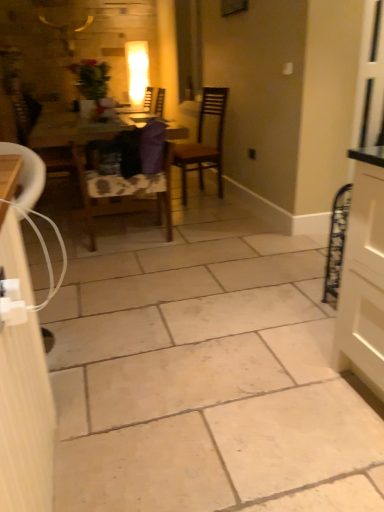
Question: From a real-world perspective, does wooden chair at left, the third chair in the right-to-left sequence, sit lower than brown wooden chair at center, which is counted as the 1th chair, starting from the right?

Choices:
 (A) no
 (B) yes

Answer: (B)

Question: Does wooden chair at left, the third chair in the right-to-left sequence, appear on the left side of brown wooden chair at center, which is counted as the 1th chair, starting from the right?

Choices:
 (A) no
 (B) yes

Answer: (B)

Question: Can you confirm if wooden chair at left, marked as the 1th chair in a left-to-right arrangement, is wider than brown wooden chair at center, which is counted as the 1th chair, starting from the right?

Choices:
 (A) yes
 (B) no

Answer: (A)

Question: From a real-world perspective, is wooden chair at left, marked as the 1th chair in a left-to-right arrangement, located higher than brown wooden chair at center, which is the third chair from left to right?

Choices:
 (A) yes
 (B) no

Answer: (B)

Question: Is wooden chair at left, the third chair in the right-to-left sequence, far away from brown wooden chair at center, which is counted as the 1th chair, starting from the right?

Choices:
 (A) yes
 (B) no

Answer: (A)

Question: Looking at their shapes, would you say white glossy cabinet at left is wider or thinner than wooden chair at left, marked as the 1th chair in a left-to-right arrangement?

Choices:
 (A) thin
 (B) wide

Answer: (A)

Question: From a real-world perspective, is white glossy cabinet at left physically located above or below wooden chair at left, marked as the 1th chair in a left-to-right arrangement?

Choices:
 (A) above
 (B) below

Answer: (B)

Question: Is white glossy cabinet at left to the left or to the right of wooden chair at left, the third chair in the right-to-left sequence, in the image?

Choices:
 (A) right
 (B) left

Answer: (A)

Question: Is point (24, 357) closer or farther from the camera than point (19, 101)?

Choices:
 (A) farther
 (B) closer

Answer: (B)

Question: Based on their positions, is wooden chair at center, arranged as the second chair when viewed from the right, located to the left or right of wooden table at center?

Choices:
 (A) left
 (B) right

Answer: (B)

Question: Is point (84, 177) closer or farther from the camera than point (175, 133)?

Choices:
 (A) closer
 (B) farther

Answer: (A)

Question: In the image, is wooden chair at center, which is the 2th chair from left to right, positioned in front of or behind wooden table at center?

Choices:
 (A) behind
 (B) front

Answer: (B)

Question: From the image's perspective, is wooden chair at center, which is the 2th chair from left to right, above or below wooden table at center?

Choices:
 (A) below
 (B) above

Answer: (A)

Question: Choose the correct answer: Is wooden chair at left, the third chair in the right-to-left sequence, inside white glossy cabinet at left or outside it?

Choices:
 (A) inside
 (B) outside

Answer: (B)

Question: Is wooden chair at left, marked as the 1th chair in a left-to-right arrangement, taller or shorter than white glossy cabinet at left?

Choices:
 (A) tall
 (B) short

Answer: (A)